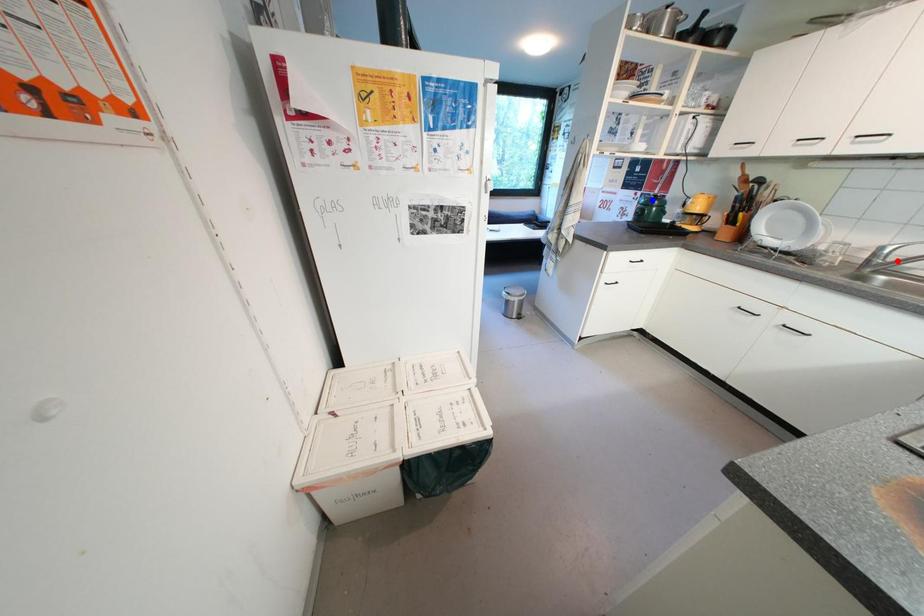
Question: Two points are marked on the image. Which point is closer to the camera?

Choices:
 (A) Blue point is closer.
 (B) Red point is closer.

Answer: (B)